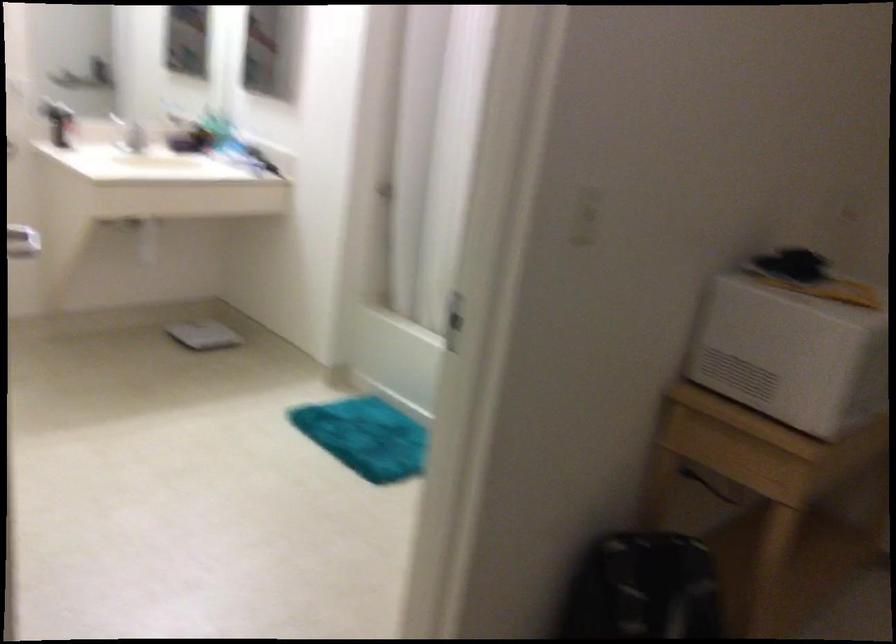
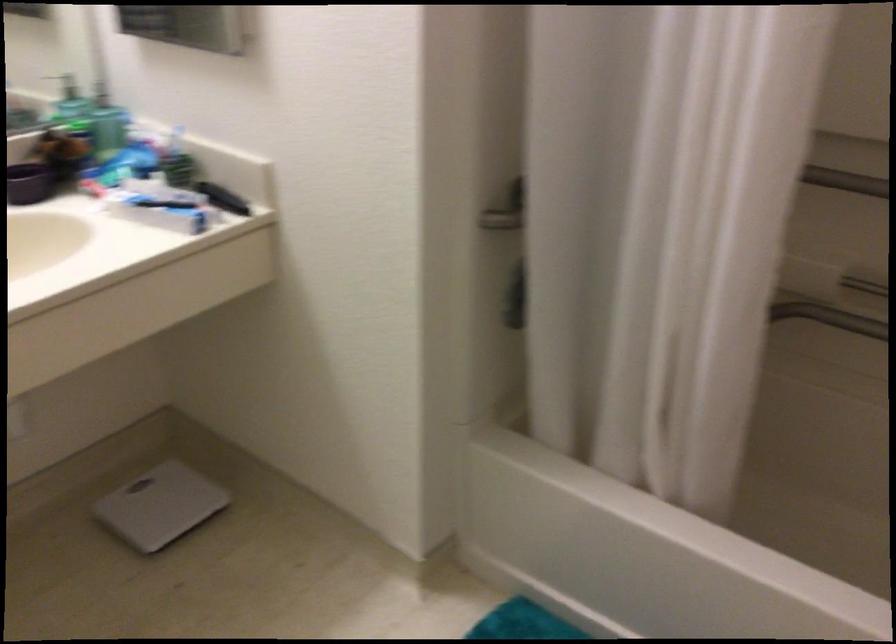
Locate, in the second image, the point that corresponds to (195,330) in the first image.

(159, 506)